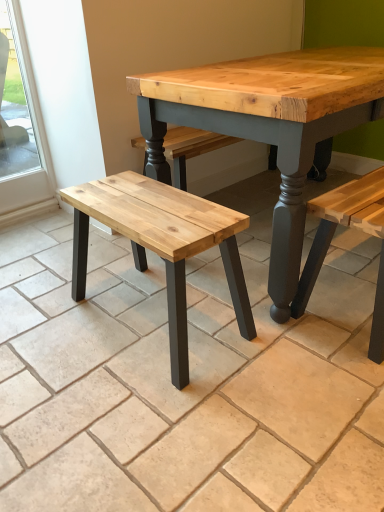
Identify the location of blank space situated above natural wood bench at center (from a real-world perspective). click(x=163, y=313).